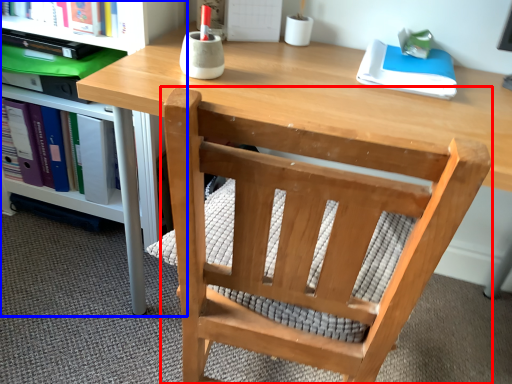
Question: Which object appears farthest to the camera in this image, chair (highlighted by a red box) or shelf (highlighted by a blue box)?

Choices:
 (A) chair
 (B) shelf

Answer: (B)